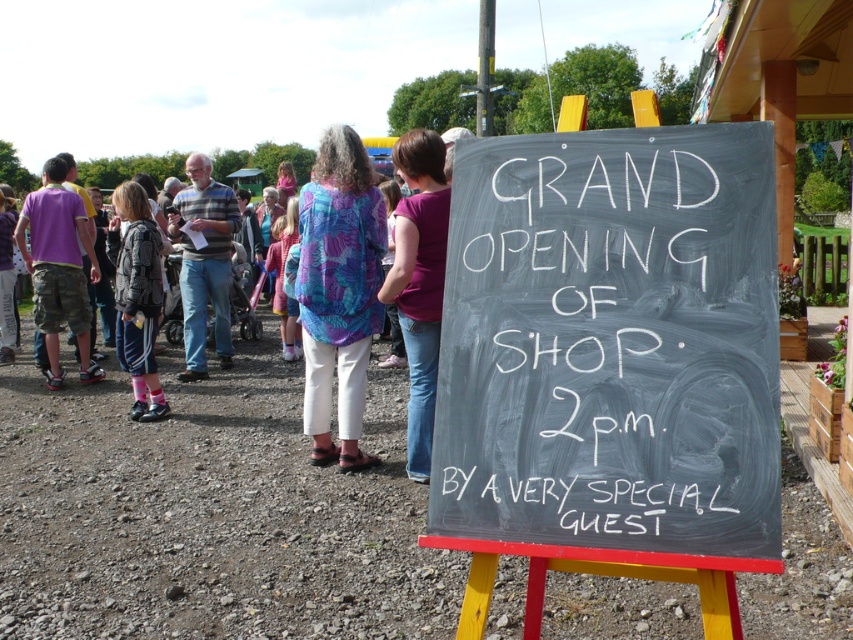
Question: Is blue floral shirt at center smaller than camo pants at left?

Choices:
 (A) no
 (B) yes

Answer: (A)

Question: Which object appears closest to the camera in this image?

Choices:
 (A) printed fabric blouse at center
 (B) blue denim jacket at left
 (C) purple fabric shirt at center

Answer: (C)

Question: Is black chalkboard at center above purple fabric shirt at center?

Choices:
 (A) yes
 (B) no

Answer: (B)

Question: Which object is the farthest from the camo pants at left?

Choices:
 (A) gray plaid shirt at left
 (B) blue denim jacket at left

Answer: (A)

Question: Does blue floral shirt at center have a larger size compared to printed fabric blouse at center?

Choices:
 (A) no
 (B) yes

Answer: (B)

Question: Among these points, which one is nearest to the camera?

Choices:
 (A) (354, 401)
 (B) (80, 465)

Answer: (A)